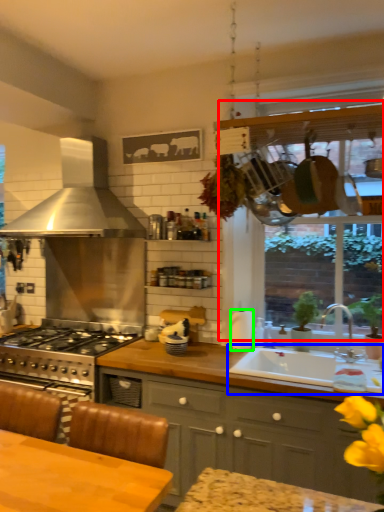
Question: Which is nearer to the window frame (highlighted by a red box)? sink (highlighted by a blue box) or appliance (highlighted by a green box).

Choices:
 (A) sink
 (B) appliance

Answer: (A)